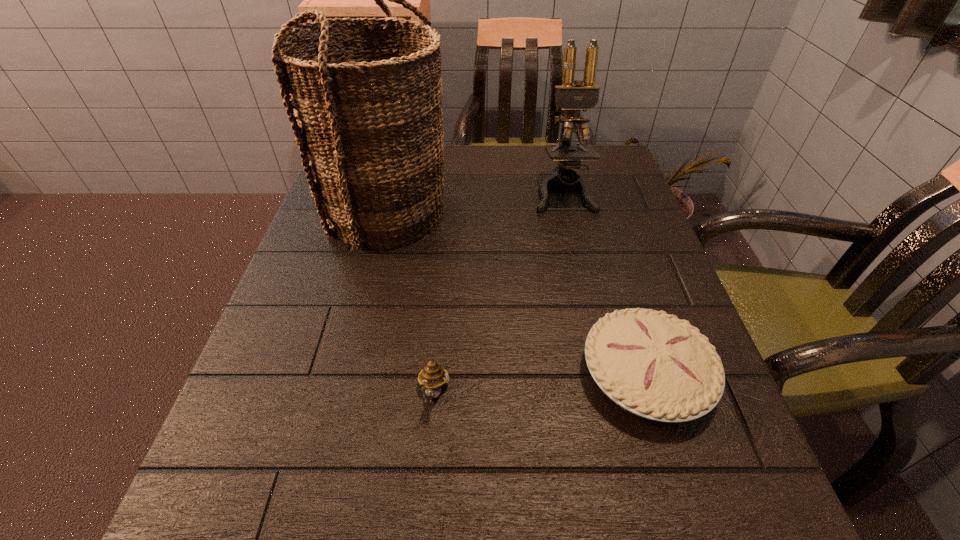
This screenshot has width=960, height=540. I want to click on object at the left edge, so click(x=368, y=119).

Where is `microscope that is at the right edge`? microscope that is at the right edge is located at coordinates (572, 98).

I want to click on pie that is positioned at the right edge, so click(x=650, y=363).

The width and height of the screenshot is (960, 540). I want to click on object present at the far left corner, so click(x=368, y=119).

Identify the location of object present at the far right corner. This screenshot has height=540, width=960. (572, 98).

Find the location of a particular element. vacant area at the far edge of the desktop is located at coordinates (501, 190).

The height and width of the screenshot is (540, 960). In the image, there is a desktop. In order to click on free space at the near edge in this screenshot , I will do `click(471, 485)`.

In the image, there is a desktop. In order to click on free region at the left edge in this screenshot , I will do `click(302, 275)`.

Image resolution: width=960 pixels, height=540 pixels. Find the location of `vacant space at the right edge of the desktop`. vacant space at the right edge of the desktop is located at coordinates (607, 198).

Locate an element on the screen. vacant space at the near right corner of the desktop is located at coordinates (644, 484).